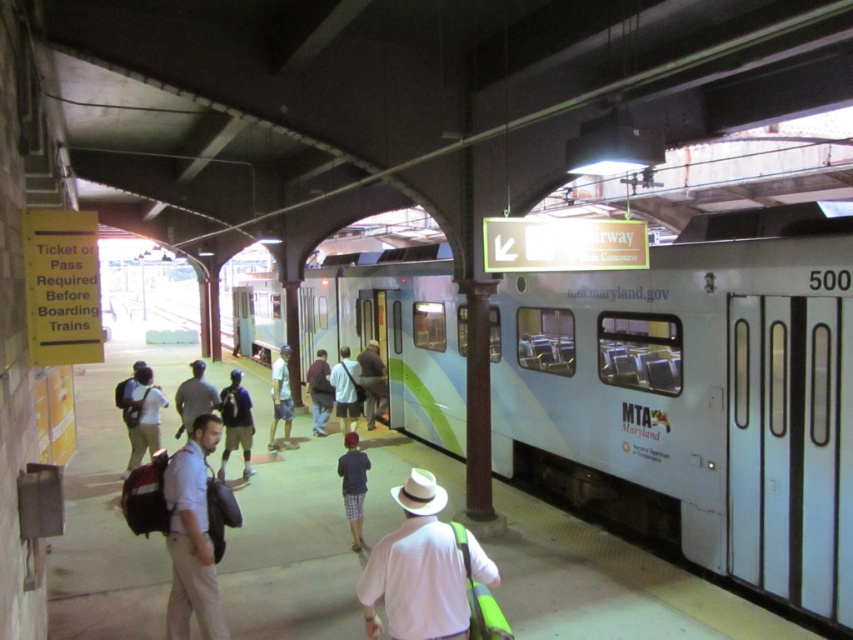
Is light blue shirt at center to the right of dark brown backpack at center from the viewer's perspective?

Indeed, light blue shirt at center is positioned on the right side of dark brown backpack at center.

Who is positioned more to the left, light blue shirt at center or dark brown backpack at center?

dark brown backpack at center is more to the left.

Which is behind, point (349, 376) or point (315, 376)?

Point (315, 376)

Where is `light blue shirt at center`? The width and height of the screenshot is (853, 640). light blue shirt at center is located at coordinates (345, 388).

Which is behind, point (154, 435) or point (335, 388)?

Positioned behind is point (335, 388).

The height and width of the screenshot is (640, 853). I want to click on light beige pants at center, so click(142, 417).

Does dark blue backpack at center come in front of dark gray shirt at center?

No, it is behind dark gray shirt at center.

Does dark blue backpack at center have a lesser width compared to dark gray shirt at center?

Yes, dark blue backpack at center is thinner than dark gray shirt at center.

This screenshot has height=640, width=853. What are the coordinates of `dark blue backpack at center` in the screenshot? It's located at (236, 422).